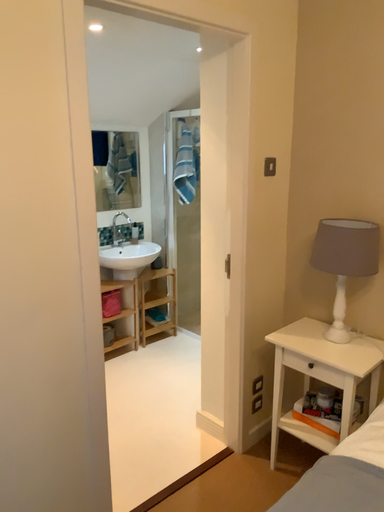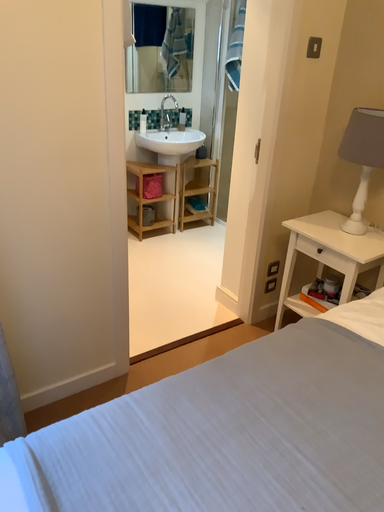
Question: Which way did the camera rotate in the video?

Choices:
 (A) rotated upward
 (B) rotated downward

Answer: (B)